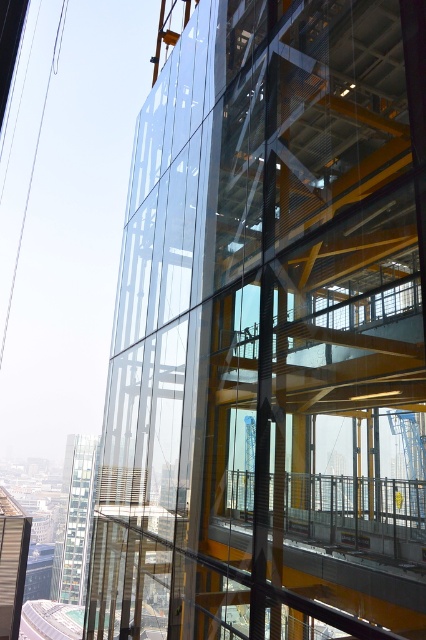
Question: Which object is closer to the camera taking this photo?

Choices:
 (A) glassy transparent tower at lower left
 (B) metallic glass tower at center

Answer: (B)

Question: Which object is farther from the camera taking this photo?

Choices:
 (A) metallic glass tower at center
 (B) glassy transparent tower at lower left

Answer: (B)

Question: Is glassy transparent tower at lower left smaller than metallic glass tower at center?

Choices:
 (A) yes
 (B) no

Answer: (B)

Question: Does glassy transparent tower at lower left have a greater width compared to metallic glass tower at center?

Choices:
 (A) yes
 (B) no

Answer: (A)

Question: Can you confirm if glassy transparent tower at lower left is smaller than metallic glass tower at center?

Choices:
 (A) yes
 (B) no

Answer: (B)

Question: Among these points, which one is nearest to the camera?

Choices:
 (A) (86, 508)
 (B) (8, 595)

Answer: (B)